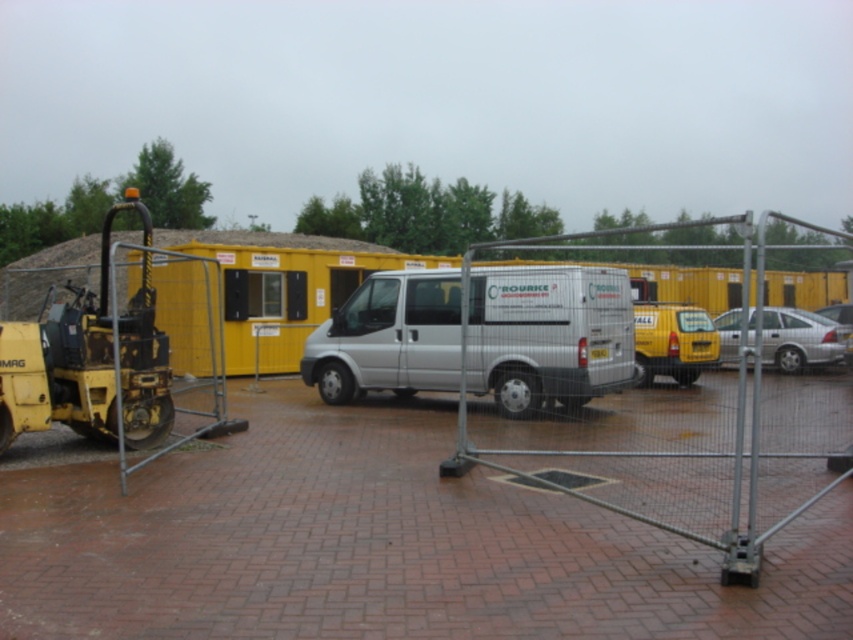
Question: Which object is the closest to the silver metallic car at right?

Choices:
 (A) silver metallic van at center
 (B) silver metallic sedan at center

Answer: (B)

Question: Which point is farther to the camera?

Choices:
 (A) yellow metal container at center
 (B) yellow matte van at center
 (C) silver metallic car at right
 (D) silver metallic sedan at center

Answer: (D)

Question: Does yellow metal container at center appear on the left side of silver metallic van at center?

Choices:
 (A) no
 (B) yes

Answer: (A)

Question: From the image, what is the correct spatial relationship of yellow metal container at center in relation to silver metallic sedan at center?

Choices:
 (A) above
 (B) below

Answer: (A)

Question: Which point appears closest to the camera in this image?

Choices:
 (A) (842, 314)
 (B) (606, 273)

Answer: (B)

Question: Is yellow matte van at center smaller than silver metallic sedan at center?

Choices:
 (A) no
 (B) yes

Answer: (B)